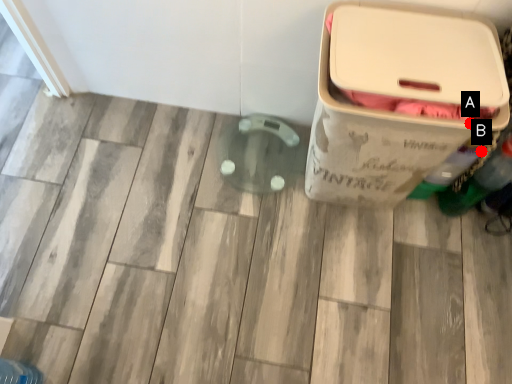
Question: Two points are circled on the image, labeled by A and B beside each circle. Among these points, which one is farthest from the camera?

Choices:
 (A) A is further
 (B) B is further

Answer: (B)